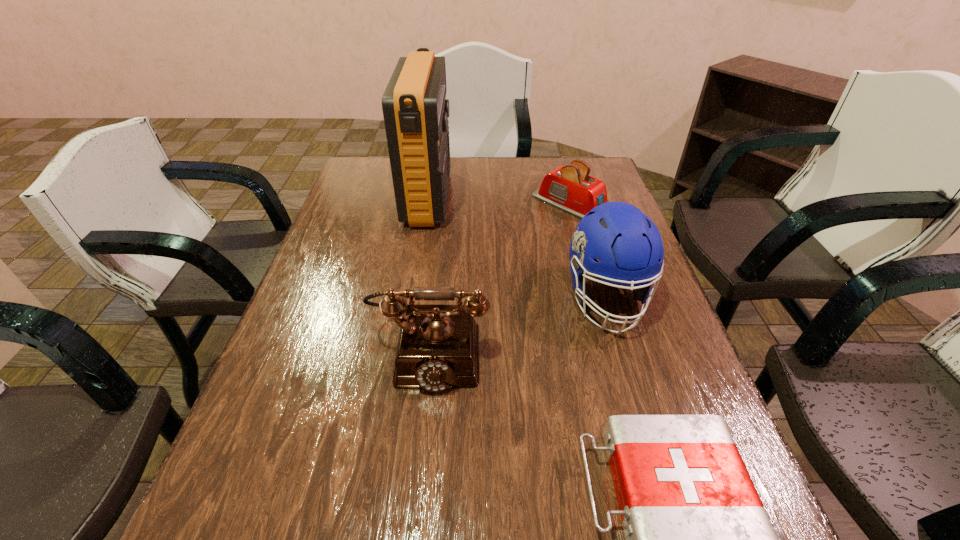
The width and height of the screenshot is (960, 540). Find the location of `the tallest object`. the tallest object is located at coordinates (415, 109).

Where is `football helmet`? football helmet is located at coordinates (628, 244).

Where is `the third tallest object`? the third tallest object is located at coordinates (438, 345).

Identify the location of toaster. The image size is (960, 540). coord(570,188).

Find the location of a particular element. free point located 0.260m on the front-facing side of the tallest object is located at coordinates (529, 198).

Locate an element on the screen. The width and height of the screenshot is (960, 540). blank space located on the front-facing side of the football helmet is located at coordinates (631, 379).

Where is `free space located 0.050m on the dial of the third shortest object`? free space located 0.050m on the dial of the third shortest object is located at coordinates (422, 418).

Locate an element on the screen. vacant space located on the left of the fourth tallest object is located at coordinates (431, 204).

Identify the location of radio receiver situated at the far edge. (415, 109).

You are a GUI agent. You are given a task and a screenshot of the screen. Output one action in this format:
    pyautogui.click(x=<x>, y=<y>)
    Task: Click on the toaster at the far edge
    The width and height of the screenshot is (960, 540).
    Given the screenshot: What is the action you would take?
    pos(570,188)